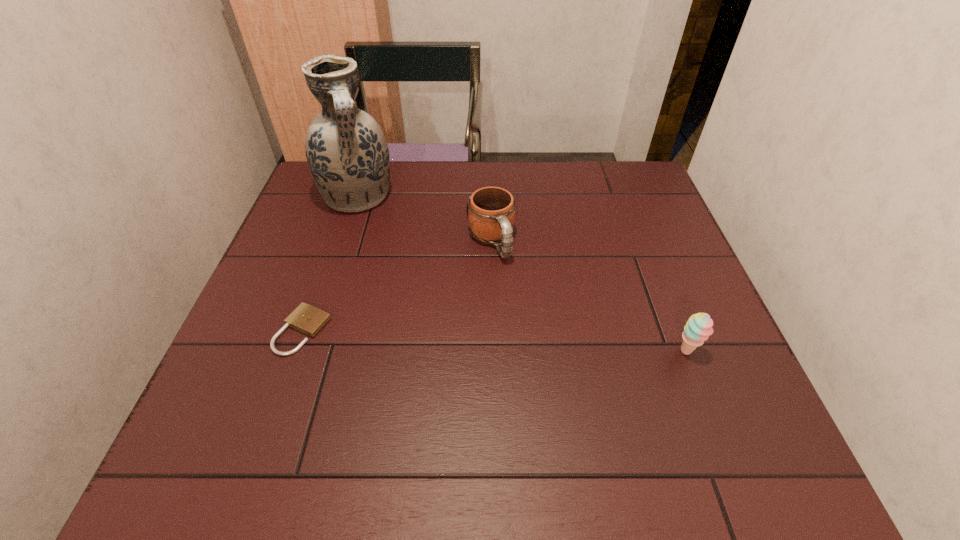
Find the location of a particular element. unoccupied position between the shortest object and the sherbert is located at coordinates (494, 341).

Select which object appears as the third closest to the padlock. Please provide its 2D coordinates. Your answer should be formatted as a tuple, i.e. [(x, y)], where the tuple contains the x and y coordinates of a point satisfying the conditions above.

[(698, 328)]

The image size is (960, 540). I want to click on object that is the closest to the rightmost object, so click(x=490, y=211).

Locate an element on the screen. This screenshot has width=960, height=540. vacant space that satisfies the following two spatial constraints: 1. on the back side of the tallest object; 2. on the left side of the padlock is located at coordinates (349, 197).